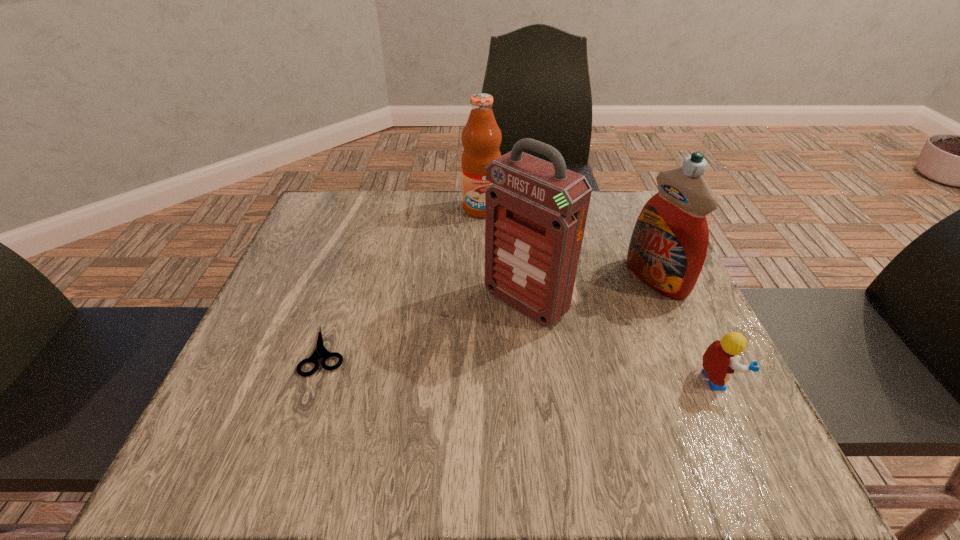
I want to click on vacant area that lies between the fruit juice and the Lego, so click(599, 295).

At what (x,y) coordinates should I click in order to perform the action: click on vacant space in between the tallest object and the detergent. Please return your answer as a coordinate pair (x, y). This screenshot has width=960, height=540. Looking at the image, I should click on (590, 291).

I want to click on free spot between the shortest object and the fruit juice, so click(403, 280).

Where is `empty space that is in between the tallest object and the second shortest object`? The image size is (960, 540). empty space that is in between the tallest object and the second shortest object is located at coordinates [620, 342].

The width and height of the screenshot is (960, 540). I want to click on free space between the shortest object and the tallest object, so click(425, 327).

Locate an element on the screen. This screenshot has height=540, width=960. vacant point located between the detergent and the first-aid kit is located at coordinates (590, 291).

This screenshot has width=960, height=540. I want to click on free spot between the shortest object and the detergent, so click(491, 315).

Where is `free point between the shortest object and the second shortest object`? Image resolution: width=960 pixels, height=540 pixels. free point between the shortest object and the second shortest object is located at coordinates (521, 366).

Identify the location of object that stands as the third closest to the second shortest object. This screenshot has width=960, height=540. (481, 137).

Where is `object identified as the closest to the farthest object`? This screenshot has height=540, width=960. object identified as the closest to the farthest object is located at coordinates (535, 211).